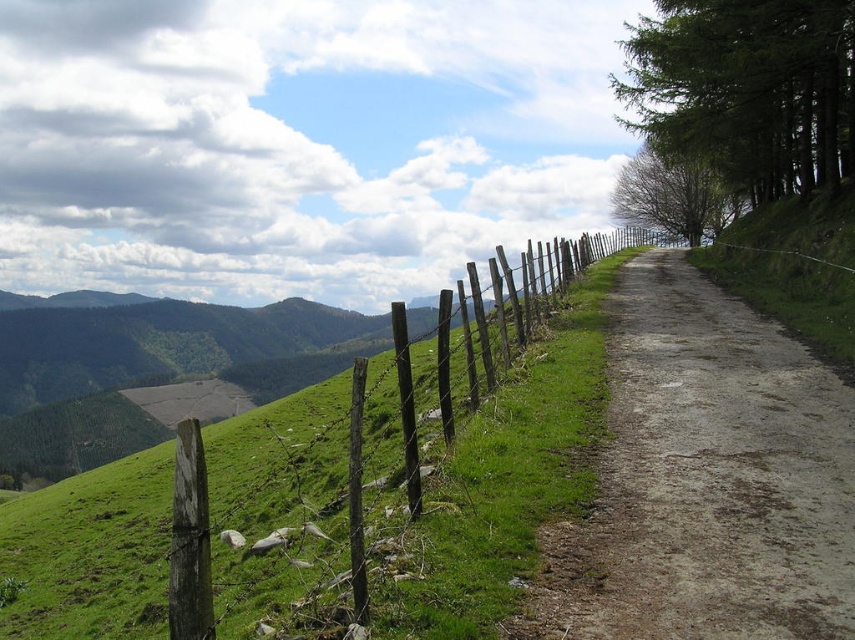
Question: Among these points, which one is nearest to the camera?

Choices:
 (A) (634, 381)
 (B) (63, 499)

Answer: (A)

Question: Is green grassy at upper left thinner than dirt/gravel path at center-right?

Choices:
 (A) no
 (B) yes

Answer: (A)

Question: Is green grassy at upper left to the right of dirt/gravel path at center-right from the viewer's perspective?

Choices:
 (A) no
 (B) yes

Answer: (A)

Question: Is green grassy at upper left positioned at the back of dirt/gravel path at center-right?

Choices:
 (A) yes
 (B) no

Answer: (B)